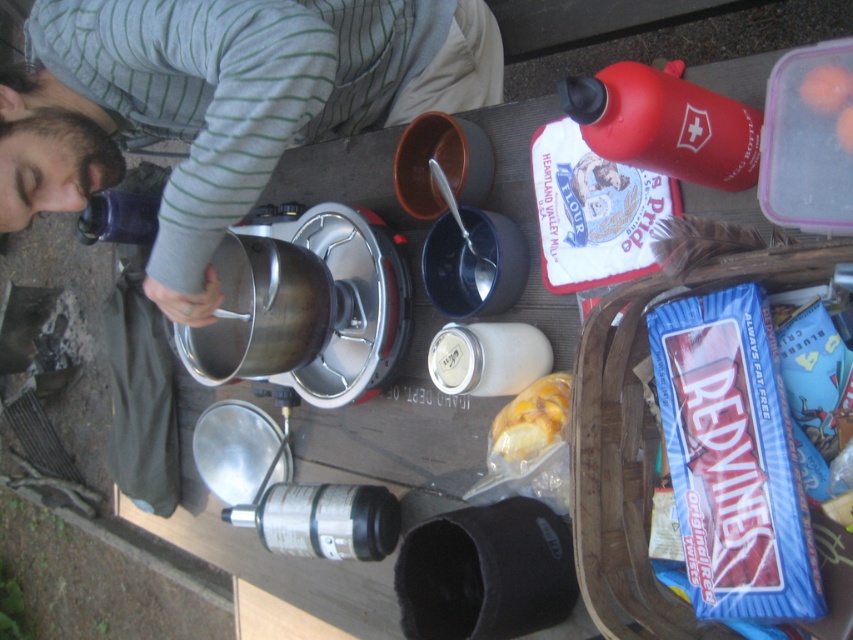
You are setting up a campsite and need to place your items. You have a red matte water bottle at upper right and a translucent plastic bag at center. Which item is nearer to you when standing at the campsite entrance?

The red matte water bottle at upper right is closer to the viewer than the translucent plastic bag at center, so the water bottle is nearer to you.

You are setting up an outdoor cooking area and need to place the red matte water bottle at upper right and the translucent plastic bag at center. Based on their positions, which item is closer to the top edge of the table?

The red matte water bottle at upper right is closer to the top edge of the table because it is positioned above the translucent plastic bag at center.

Based on the photo, you are a hiker who needs to retrieve both the translucent plastic bag at center and the transparent plastic bottle at upper left. The path between them is narrow. Can you reach both items without moving either of them?

The translucent plastic bag at center and transparent plastic bottle at upper left are 30.47 inches apart from each other. Since the distance between them is over 30 inches, you can easily reach both items without moving them.